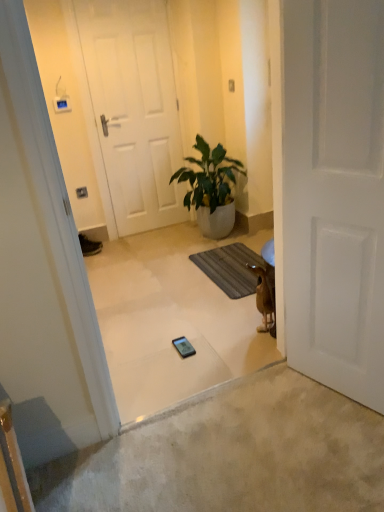
Image resolution: width=384 pixels, height=512 pixels. What do you see at coordinates (334, 193) in the screenshot?
I see `white matte door at right, which is the second door from back to front` at bounding box center [334, 193].

You are a GUI agent. You are given a task and a screenshot of the screen. Output one action in this format:
    pyautogui.click(x=<x>, y=<y>)
    Task: Click on the matte black sneaker at lower left
    This screenshot has height=512, width=384.
    Given the screenshot: What is the action you would take?
    pyautogui.click(x=89, y=246)

At what (x,y) coordinates should I click in order to perform the action: click on white matte door at center, the 2th door in the right-to-left sequence. Please return your answer as a coordinate pair (x, y). The height and width of the screenshot is (512, 384). Looking at the image, I should click on (134, 109).

In order to face brown textured bath mat at center, should I rotate leftwards or rightwards?

Rotate your view right by about 5.923°.

The image size is (384, 512). Identify the location of matte black phone at center. (183, 347).

This screenshot has height=512, width=384. Identify the location of the 1st door positioned above the matte black phone at center (from the image's perspective). (334, 193).

Is white matte door at right, which is the second door from back to front, oriented away from matte black phone at center?

No, white matte door at right, which is the second door from back to front, is not facing away from matte black phone at center.

Measure the distance from white matte door at right, placed as the second door when sorted from left to right, to matte black phone at center.

white matte door at right, placed as the second door when sorted from left to right, is 3.42 feet from matte black phone at center.

Considering the relative positions of white matte door at right, which is the second door from back to front, and matte black phone at center in the image provided, is white matte door at right, which is the second door from back to front, to the left or to the right of matte black phone at center?

In the image, white matte door at right, which is the second door from back to front, appears on the right side of matte black phone at center.

From the image's perspective, which is above, matte black sneaker at lower left or brown textured bath mat at center?

matte black sneaker at lower left, from the image's perspective.

Looking at this image, could you tell me if matte black sneaker at lower left is turned towards brown textured bath mat at center?

No.

Considering the positions of objects matte black sneaker at lower left and brown textured bath mat at center in the image provided, who is more to the left, matte black sneaker at lower left or brown textured bath mat at center?

From the viewer's perspective, matte black sneaker at lower left appears more on the left side.

Considering the sizes of objects matte black sneaker at lower left and brown textured bath mat at center in the image provided, who is thinner, matte black sneaker at lower left or brown textured bath mat at center?

matte black sneaker at lower left.

Can you confirm if white matte door at center, the 2th door in the right-to-left sequence, is shorter than green glossy plant at center?

No.

Measure the distance from white matte door at center, marked as the 2th door in a front-to-back arrangement, to green glossy plant at center.

white matte door at center, marked as the 2th door in a front-to-back arrangement, is 60.16 centimeters away from green glossy plant at center.

Is point (105, 113) positioned before point (221, 212)?

No.

From a real-world perspective, is white matte door at center, the 1th door from the left, physically located above or below green glossy plant at center?

white matte door at center, the 1th door from the left, is situated higher than green glossy plant at center in the real world.

Considering the relative positions of matte black phone at center and white matte door at right, which is the first door from front to back, in the image provided, is matte black phone at center to the left or to the right of white matte door at right, which is the first door from front to back,?

In the image, matte black phone at center appears on the left side of white matte door at right, which is the first door from front to back.

Measure the distance from matte black phone at center to white matte door at right, which is the second door from back to front.

matte black phone at center and white matte door at right, which is the second door from back to front, are 3.42 feet apart from each other.

Image resolution: width=384 pixels, height=512 pixels. Find the location of `the 1st door directly above the matte black phone at center (from a real-world perspective)`. the 1st door directly above the matte black phone at center (from a real-world perspective) is located at coordinates (334, 193).

Does brown textured bath mat at center have a greater width compared to green glossy plant at center?

No.

Which is more distant, (189, 257) or (218, 148)?

The point (189, 257) is behind.

Which is more to the left, brown textured bath mat at center or green glossy plant at center?

From the viewer's perspective, green glossy plant at center appears more on the left side.

What's the angular difference between white matte door at center, arranged as the 1th door when viewed from the back, and matte black sneaker at lower left's facing directions?

14 degrees.

Based on their sizes in the image, would you say white matte door at center, the 2th door in the right-to-left sequence, is bigger or smaller than matte black sneaker at lower left?

In the image, white matte door at center, the 2th door in the right-to-left sequence, appears to be larger than matte black sneaker at lower left.

Considering the sizes of objects white matte door at center, marked as the 2th door in a front-to-back arrangement, and matte black sneaker at lower left in the image provided, who is thinner, white matte door at center, marked as the 2th door in a front-to-back arrangement, or matte black sneaker at lower left?

white matte door at center, marked as the 2th door in a front-to-back arrangement, is thinner.

In the image, is white matte door at center, the 1th door from the left, on the left side or the right side of matte black sneaker at lower left?

Clearly, white matte door at center, the 1th door from the left, is on the right of matte black sneaker at lower left in the image.

Is matte black phone at center turned away from green glossy plant at center?

That's not correct — matte black phone at center is not looking away from green glossy plant at center.

Which is farther from the camera, (x=193, y=349) or (x=214, y=148)?

The point (x=214, y=148) is more distant.

Are matte black phone at center and green glossy plant at center beside each other?

No, matte black phone at center is not next to green glossy plant at center.

There is a matte black phone at center. Find the location of `the 1st door above it (from a real-world perspective)`. the 1st door above it (from a real-world perspective) is located at coordinates (334, 193).

Locate an element on the screen. This screenshot has width=384, height=512. bath mat beneath the matte black sneaker at lower left (from a real-world perspective) is located at coordinates (232, 268).

Considering their positions, is green glossy plant at center positioned further to matte black phone at center than brown textured bath mat at center?

green glossy plant at center lies further to matte black phone at center than the other object.

Considering their positions, is white matte door at right, which appears as the 1th door when viewed from the right, positioned further to matte black sneaker at lower left than matte black phone at center?

white matte door at right, which appears as the 1th door when viewed from the right, is positioned further to the anchor matte black sneaker at lower left.

Consider the image. Which object lies nearer to the anchor point matte black sneaker at lower left, brown textured bath mat at center or white matte door at center, arranged as the 1th door when viewed from the back?

white matte door at center, arranged as the 1th door when viewed from the back, lies closer to matte black sneaker at lower left than the other object.

Which object lies nearer to the anchor point brown furry dog at lower right, white matte door at center, the 1th door from the left, or green glossy plant at center?

Based on the image, green glossy plant at center appears to be nearer to brown furry dog at lower right.

Looking at the image, which one is located closer to white matte door at right, which appears as the 1th door when viewed from the right, matte black sneaker at lower left or matte black phone at center?

matte black phone at center.

From the image, which object appears to be farther from brown furry dog at lower right, white matte door at right, which is the first door from front to back, or matte black sneaker at lower left?

matte black sneaker at lower left is further to brown furry dog at lower right.

Which object lies nearer to the anchor point brown textured bath mat at center, matte black phone at center or brown furry dog at lower right?

brown furry dog at lower right is closer to brown textured bath mat at center.

Looking at the image, which one is located further to brown furry dog at lower right, matte black phone at center or matte black sneaker at lower left?

matte black sneaker at lower left lies further to brown furry dog at lower right than the other object.

The image size is (384, 512). I want to click on houseplant located between brown furry dog at lower right and matte black sneaker at lower left in the depth direction, so point(211,189).

Identify the location of bath mat positioned between white matte door at right, which is the second door from back to front, and green glossy plant at center from near to far. The image size is (384, 512). pyautogui.click(x=232, y=268).

You are a GUI agent. You are given a task and a screenshot of the screen. Output one action in this format:
    pyautogui.click(x=<x>, y=<y>)
    Task: Click on the houseplant between white matte door at center, the 1th door from the left, and brown textured bath mat at center from top to bottom
    The width and height of the screenshot is (384, 512).
    Given the screenshot: What is the action you would take?
    pyautogui.click(x=211, y=189)

At what (x,y) coordinates should I click in order to perform the action: click on bath mat between matte black phone at center and matte black sneaker at lower left in the front-back direction. Please return your answer as a coordinate pair (x, y). Looking at the image, I should click on (232, 268).